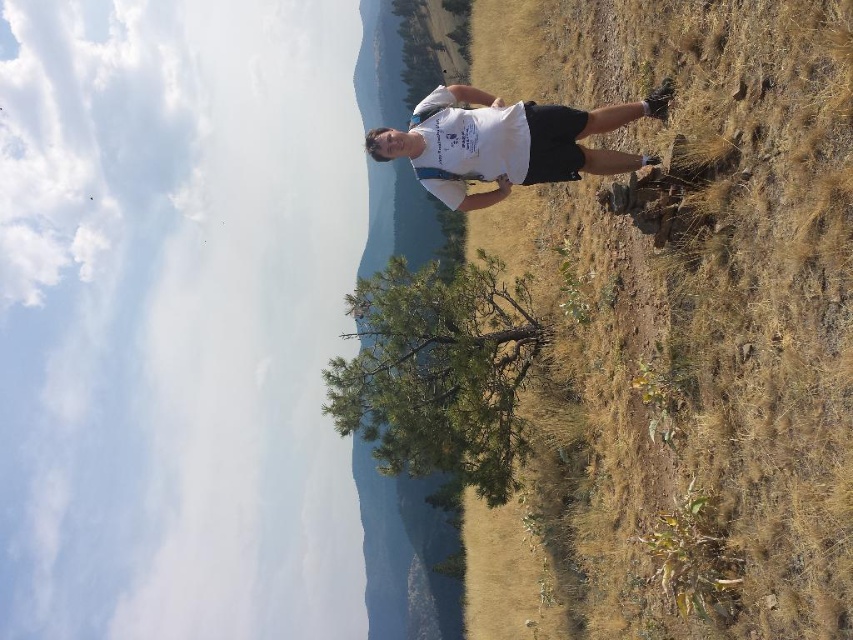
Is point (625, 273) positioned behind point (570, 138)?

Yes, point (625, 273) is behind point (570, 138).

Can you confirm if dry grass at right is positioned to the left of white t-shirt at center?

Incorrect, dry grass at right is not on the left side of white t-shirt at center.

Between point (836, 371) and point (514, 113), which one is positioned in front?

Point (836, 371) is in front.

Identify the location of dry grass at right. Image resolution: width=853 pixels, height=640 pixels. (705, 307).